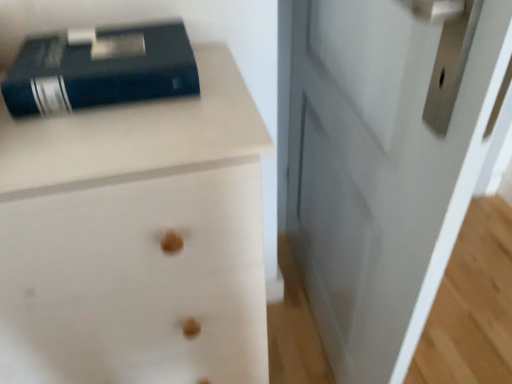
Question: Is white wood chest of drawers at upper left positioned before white glossy door at center?

Choices:
 (A) no
 (B) yes

Answer: (A)

Question: Is white wood chest of drawers at upper left taller than white glossy door at center?

Choices:
 (A) no
 (B) yes

Answer: (A)

Question: Does white wood chest of drawers at upper left appear on the right side of white glossy door at center?

Choices:
 (A) no
 (B) yes

Answer: (A)

Question: Is white wood chest of drawers at upper left outside of white glossy door at center?

Choices:
 (A) no
 (B) yes

Answer: (B)

Question: Considering the relative sizes of white wood chest of drawers at upper left and white glossy door at center in the image provided, is white wood chest of drawers at upper left bigger than white glossy door at center?

Choices:
 (A) no
 (B) yes

Answer: (B)

Question: Considering their positions, is white wood chest of drawers at upper left located in front of or behind white glossy door at center?

Choices:
 (A) front
 (B) behind

Answer: (B)

Question: Is white wood chest of drawers at upper left inside the boundaries of white glossy door at center, or outside?

Choices:
 (A) outside
 (B) inside

Answer: (A)

Question: From a real-world perspective, is white wood chest of drawers at upper left above or below white glossy door at center?

Choices:
 (A) below
 (B) above

Answer: (A)

Question: Considering the positions of white wood chest of drawers at upper left and white glossy door at center in the image, is white wood chest of drawers at upper left wider or thinner than white glossy door at center?

Choices:
 (A) wide
 (B) thin

Answer: (A)

Question: Choose the correct answer: Is white glossy door at center inside white wood chest of drawers at upper left or outside it?

Choices:
 (A) outside
 (B) inside

Answer: (A)

Question: Is white glossy door at center taller or shorter than white wood chest of drawers at upper left?

Choices:
 (A) short
 (B) tall

Answer: (B)

Question: Considering the positions of white glossy door at center and white wood chest of drawers at upper left in the image, is white glossy door at center bigger or smaller than white wood chest of drawers at upper left?

Choices:
 (A) big
 (B) small

Answer: (B)

Question: Based on their positions, is white glossy door at center located to the left or right of white wood chest of drawers at upper left?

Choices:
 (A) left
 (B) right

Answer: (B)

Question: Considering the positions of point (416, 137) and point (15, 86), is point (416, 137) closer or farther from the camera than point (15, 86)?

Choices:
 (A) closer
 (B) farther

Answer: (A)

Question: Looking at their shapes, would you say white glossy door at center is wider or thinner than matte black book at upper left?

Choices:
 (A) wide
 (B) thin

Answer: (B)